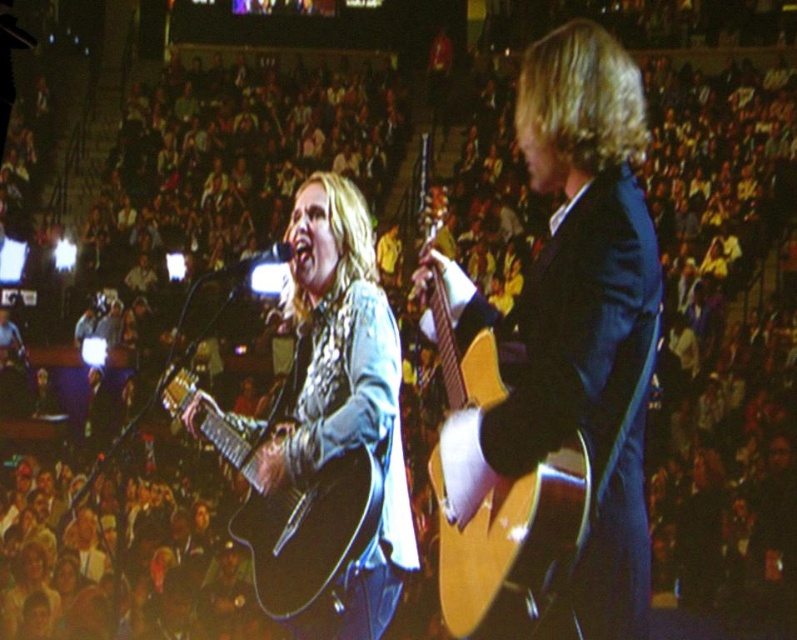
Question: Among these objects, which one is farthest from the camera?

Choices:
 (A) shiny brown guitar at center
 (B) matte black guitar at center

Answer: (B)

Question: Which is nearer to the matte black guitar at center?

Choices:
 (A) matte black acoustic guitar at center
 (B) shiny brown guitar at center

Answer: (A)

Question: Can you confirm if shiny brown guitar at center is bigger than matte black guitar at center?

Choices:
 (A) no
 (B) yes

Answer: (B)

Question: Which of the following is the farthest from the observer?

Choices:
 (A) matte black guitar at center
 (B) shiny brown guitar at center
 (C) matte black acoustic guitar at center

Answer: (A)

Question: Does shiny brown guitar at center have a lesser width compared to matte black guitar at center?

Choices:
 (A) no
 (B) yes

Answer: (A)

Question: Where is matte black guitar at center located in relation to matte black acoustic guitar at center in the image?

Choices:
 (A) below
 (B) above

Answer: (B)